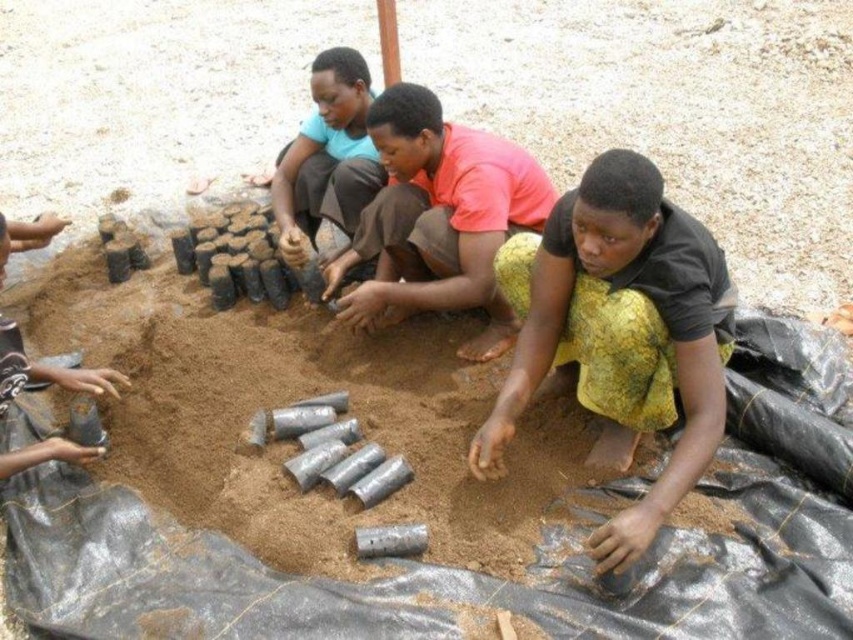
The height and width of the screenshot is (640, 853). What do you see at coordinates (621, 333) in the screenshot?
I see `yellow textured cloth at center` at bounding box center [621, 333].

Between yellow textured cloth at center and pink matte shirt at center, which one appears on the right side from the viewer's perspective?

yellow textured cloth at center is more to the right.

Identify the location of yellow textured cloth at center. Image resolution: width=853 pixels, height=640 pixels. (621, 333).

Is brown sandy soil at center below matte brown shirt at center?

Yes.

Which is behind, point (265, 566) or point (346, 97)?

The point (346, 97) is behind.

Where is `brown sandy soil at center`? brown sandy soil at center is located at coordinates (403, 490).

The height and width of the screenshot is (640, 853). Find the location of `brown sandy soil at center`. brown sandy soil at center is located at coordinates (403, 490).

Can you confirm if matte brown shirt at center is wider than matte black pot at lower left?

Indeed, matte brown shirt at center has a greater width compared to matte black pot at lower left.

Who is lower down, matte brown shirt at center or matte black pot at lower left?

matte black pot at lower left is below.

Locate an element on the screen. The height and width of the screenshot is (640, 853). matte brown shirt at center is located at coordinates [x=328, y=156].